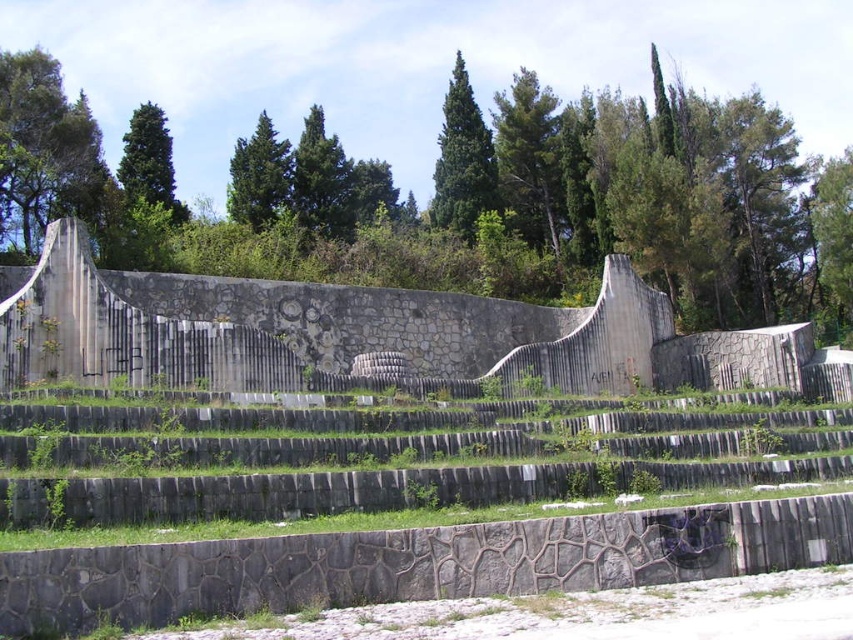
You are standing at the top of the amphitheater structure and want to walk down to the lower area. There are two points marked on the ground below you. One is labeled as point (x=299, y=468) and the other as point (x=143, y=161). According to the image, which point is closer to the amphitheater structure?

Point (x=143, y=161) is closer to the amphitheater structure because point (x=299, y=468) is in front of it, meaning it is further away from the structure.

You are standing at the point marked by the coordinates point (376, 412). Based on the scene description, what structure are you likely standing on?

The point (376, 412) marks the stone amphitheater at center, so you are likely standing on the stone amphitheater at center.